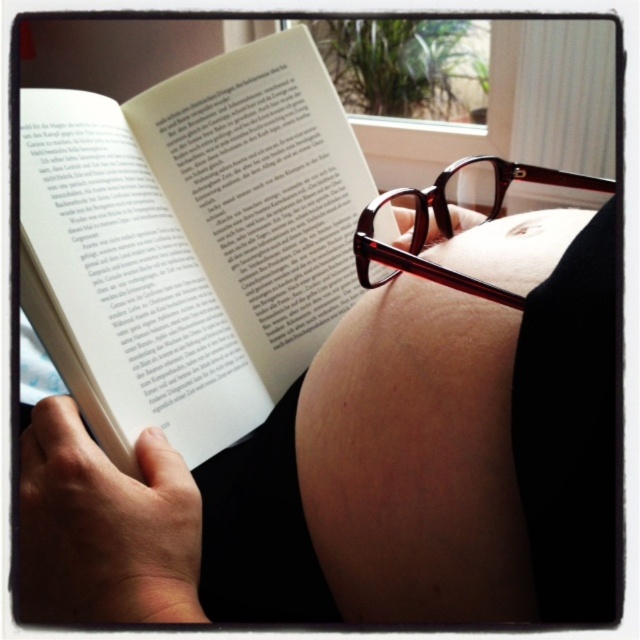
Question: Does matte skin belly at center appear on the right side of translucent tortoiseshell glasses at center?

Choices:
 (A) no
 (B) yes

Answer: (A)

Question: Which point is closer to the camera taking this photo?

Choices:
 (A) (525, 483)
 (B) (445, 221)
 (C) (355, 188)

Answer: (A)

Question: Which object is farther from the camera taking this photo?

Choices:
 (A) matte skin belly at center
 (B) white paper at upper left
 (C) translucent tortoiseshell glasses at center

Answer: (B)

Question: Is matte skin belly at center further to camera compared to white paper at upper left?

Choices:
 (A) no
 (B) yes

Answer: (A)

Question: Can you confirm if matte skin belly at center is smaller than white paper at upper left?

Choices:
 (A) no
 (B) yes

Answer: (A)

Question: Which of the following is the farthest from the observer?

Choices:
 (A) (305, 420)
 (B) (374, 198)

Answer: (B)